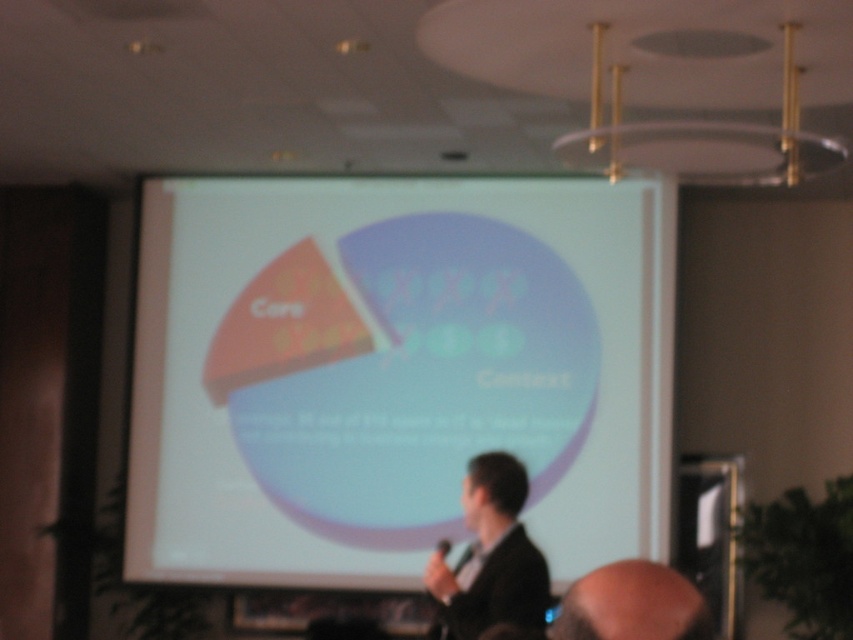
Is matte white projection screen at center below dark suit at center?

Incorrect, matte white projection screen at center is not positioned below dark suit at center.

Describe the element at coordinates (393, 371) in the screenshot. This screenshot has height=640, width=853. I see `matte white projection screen at center` at that location.

This screenshot has width=853, height=640. What do you see at coordinates (393, 371) in the screenshot? I see `matte white projection screen at center` at bounding box center [393, 371].

Locate an element on the screen. This screenshot has height=640, width=853. matte white projection screen at center is located at coordinates (393, 371).

Does dark suit at center appear on the left side of bald head at lower right?

Yes, dark suit at center is to the left of bald head at lower right.

Who is more forward, (488,548) or (659,620)?

Point (659,620) is more forward.

Locate an element on the screen. dark suit at center is located at coordinates (491, 556).

Locate an element on the screen. Image resolution: width=853 pixels, height=640 pixels. dark suit at center is located at coordinates (491, 556).

Does matte white projection screen at center have a greater width compared to bald head at lower right?

Yes.

Who is more distant from viewer, (531, 493) or (599, 572)?

The point (531, 493) is more distant.

Identify the location of matte white projection screen at center. (393, 371).